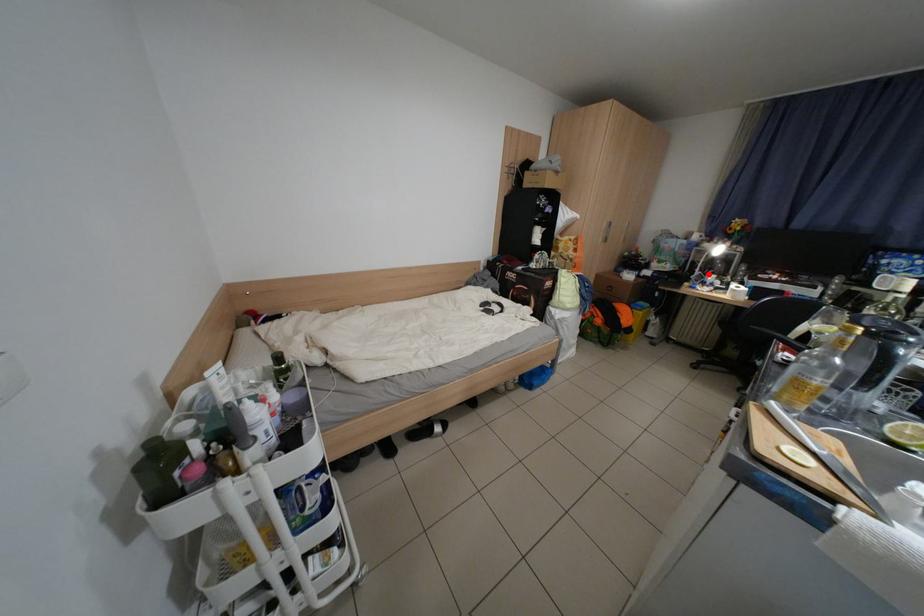
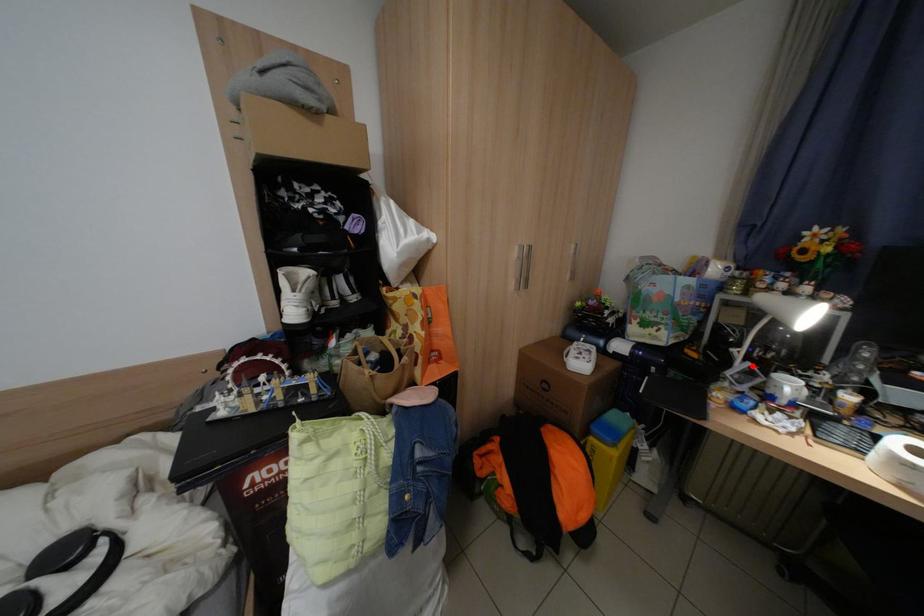
I am providing you with two images of the same scene from different viewpoints. A red point is marked on the first image and another point is marked on the second image. Are the points marked in image1 and image2 representing the same 3D position?

Yes